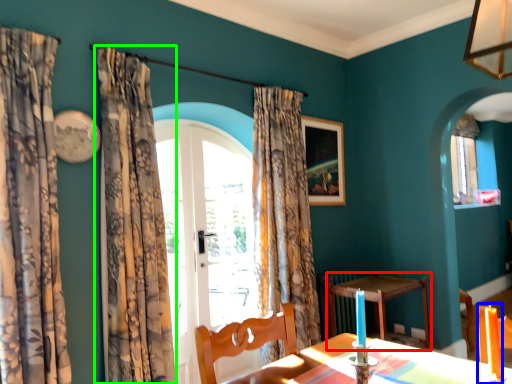
Question: Which object is the closest to the table (highlighted by a red box)? Choose among these: candle (highlighted by a blue box) or curtain (highlighted by a green box).

Choices:
 (A) candle
 (B) curtain

Answer: (B)